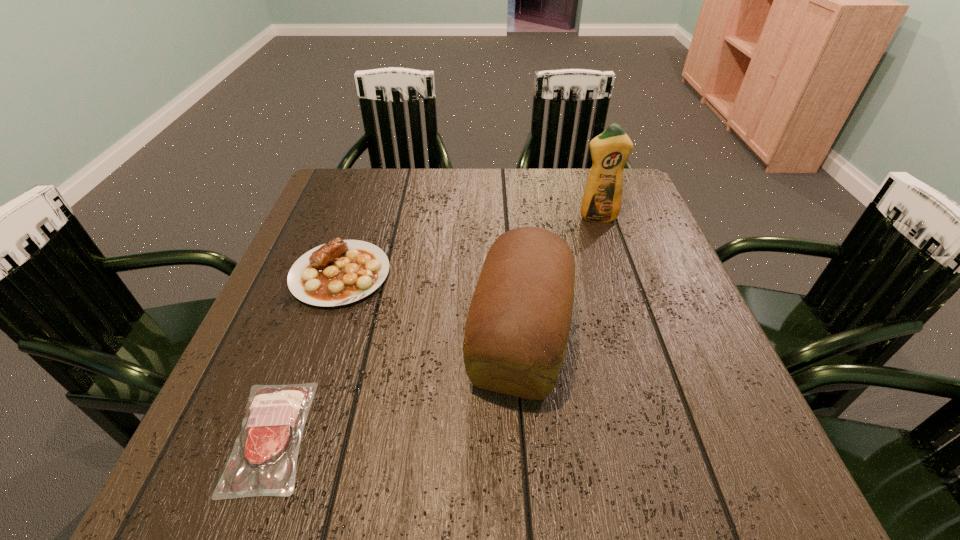
Locate an element on the screen. The height and width of the screenshot is (540, 960). the tallest object is located at coordinates (602, 199).

Locate an element on the screen. The width and height of the screenshot is (960, 540). the farthest object is located at coordinates (602, 199).

Where is `the second tallest object`? This screenshot has width=960, height=540. the second tallest object is located at coordinates (516, 333).

Locate an element on the screen. This screenshot has width=960, height=540. the third object from left to right is located at coordinates (516, 333).

The image size is (960, 540). I want to click on the taller steak, so click(340, 272).

Where is `the farther steak`? The image size is (960, 540). the farther steak is located at coordinates (340, 272).

In order to click on the nearer steak in this screenshot , I will do `click(268, 445)`.

You are a GUI agent. You are given a task and a screenshot of the screen. Output one action in this format:
    pyautogui.click(x=<x>, y=<y>)
    Task: Click on the shortest object
    The width and height of the screenshot is (960, 540).
    Given the screenshot: What is the action you would take?
    pyautogui.click(x=268, y=445)

The width and height of the screenshot is (960, 540). In order to click on free space located on the label of the tallest object in this screenshot , I will do `click(636, 336)`.

The width and height of the screenshot is (960, 540). Identify the location of free point located on the right of the third shortest object. (700, 337).